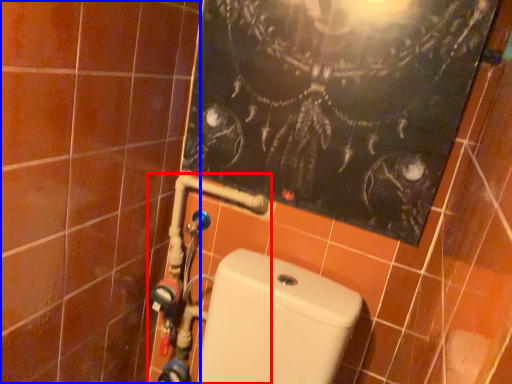
Question: Which object is further to the camera taking this photo, water pipe (highlighted by a red box) or ceramic tile (highlighted by a blue box)?

Choices:
 (A) water pipe
 (B) ceramic tile

Answer: (A)